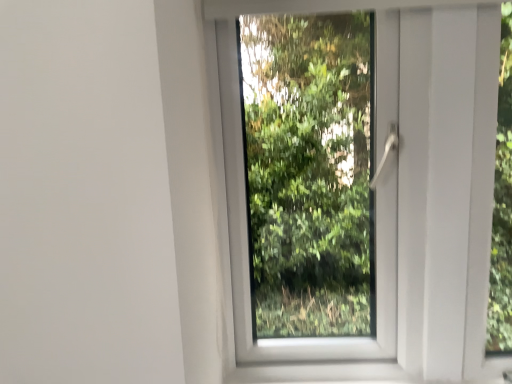
In the scene shown: In order to face white plastic window at center, should I rotate leftwards or rightwards?

Turn right approximately 15.121 degrees to face it.

The width and height of the screenshot is (512, 384). Describe the element at coordinates (394, 190) in the screenshot. I see `white plastic window at center` at that location.

The height and width of the screenshot is (384, 512). I want to click on white plastic window at center, so click(x=394, y=190).

The height and width of the screenshot is (384, 512). I want to click on white plastic window at center, so click(394, 190).